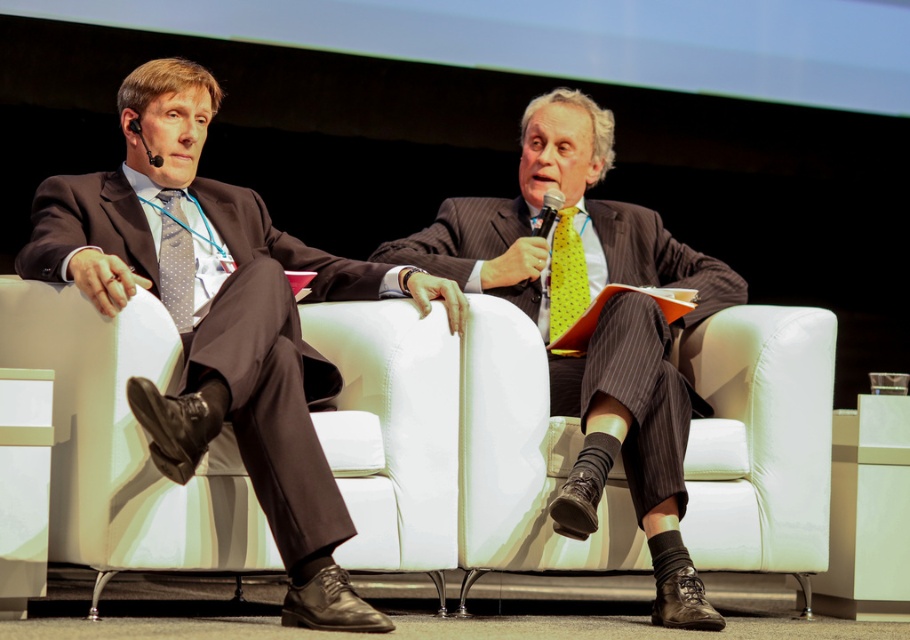
Can you confirm if yellow dotted fabric tie at center is positioned below matte gray tie at left?

Yes.

Which is below, yellow dotted fabric tie at center or matte gray tie at left?

Positioned lower is yellow dotted fabric tie at center.

Where is `yellow dotted fabric tie at center`? yellow dotted fabric tie at center is located at coordinates (565, 276).

Find the location of a particular element. Image resolution: width=910 pixels, height=640 pixels. white leather armchair at center is located at coordinates (455, 445).

Does white leather armchair at center have a larger size compared to matte black suit at center?

Yes.

This screenshot has height=640, width=910. Describe the element at coordinates (455, 445) in the screenshot. I see `white leather armchair at center` at that location.

You are a GUI agent. You are given a task and a screenshot of the screen. Output one action in this format:
    pyautogui.click(x=<x>, y=<y>)
    Task: Click on the white leather armchair at center
    Image resolution: width=910 pixels, height=640 pixels.
    Given the screenshot: What is the action you would take?
    pyautogui.click(x=455, y=445)

Which is below, white leather armchair at center or matte gray tie at left?

white leather armchair at center is lower down.

Between white leather armchair at center and matte gray tie at left, which one has more height?

Standing taller between the two is white leather armchair at center.

Where is `white leather armchair at center`? white leather armchair at center is located at coordinates (455, 445).